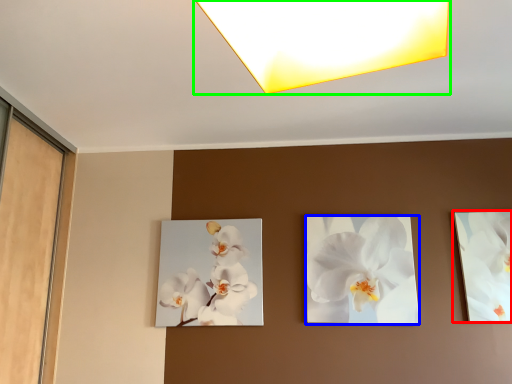
Question: Estimate the real-world distances between objects in this image. Which object is closer to picture frame (highlighted by a red box), flower (highlighted by a blue box) or lamp (highlighted by a green box)?

Choices:
 (A) flower
 (B) lamp

Answer: (A)